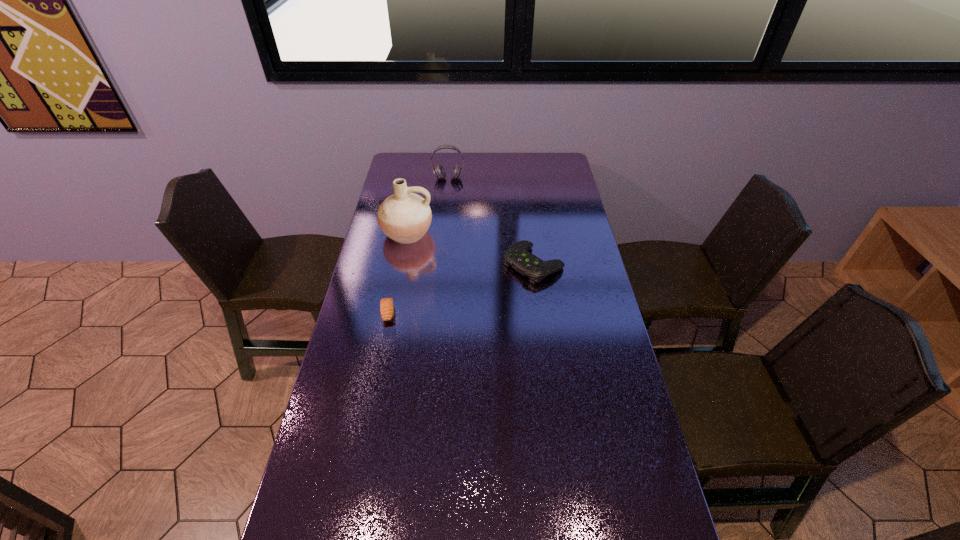
Find the location of a particular element. This screenshot has width=960, height=540. unoccupied position between the third tallest object and the shortest object is located at coordinates (461, 288).

The width and height of the screenshot is (960, 540). Find the location of `free space between the tallest object and the second shortest object`. free space between the tallest object and the second shortest object is located at coordinates (470, 248).

You are a GUI agent. You are given a task and a screenshot of the screen. Output one action in this format:
    pyautogui.click(x=<x>, y=<y>)
    Task: Click on the empty space between the tallest object and the control
    This screenshot has height=540, width=960.
    Given the screenshot: What is the action you would take?
    pyautogui.click(x=470, y=248)

Locate an element on the screen. The width and height of the screenshot is (960, 540). empty space that is in between the control and the nearest object is located at coordinates (461, 288).

This screenshot has width=960, height=540. In order to click on free space between the sushi and the second shortest object in this screenshot , I will do `click(461, 288)`.

Find the location of `vacant area between the rightmost object and the third shortest object`. vacant area between the rightmost object and the third shortest object is located at coordinates (491, 221).

Find the location of `vacant space in between the control and the farthest object`. vacant space in between the control and the farthest object is located at coordinates (491, 221).

This screenshot has height=540, width=960. Identify the location of free space between the shortest object and the headset. (419, 246).

The height and width of the screenshot is (540, 960). I want to click on object that is the closest to the third shortest object, so click(404, 217).

Locate which object ranks in proximity to the farthest object. Please provide its 2D coordinates. Your answer should be formatted as a tuple, i.e. [(x, y)], where the tuple contains the x and y coordinates of a point satisfying the conditions above.

[(404, 217)]